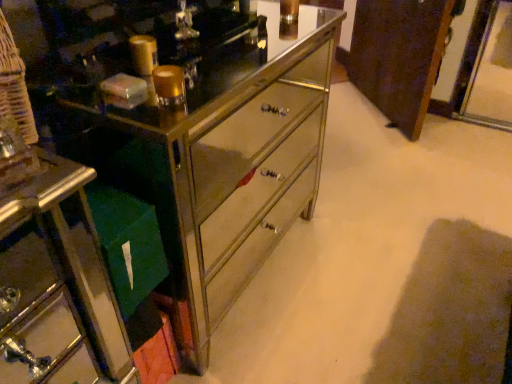
Question: Relative to brown wood cabinet at center, is metallic mirrored chest of drawers at center in front or behind?

Choices:
 (A) behind
 (B) front

Answer: (B)

Question: In terms of size, does metallic mirrored chest of drawers at center appear bigger or smaller than brown wood cabinet at center?

Choices:
 (A) big
 (B) small

Answer: (A)

Question: Considering the real-world distances, which object is closest to the green fabric bag at lower left?

Choices:
 (A) brown wood cabinet at center
 (B) metallic mirrored chest of drawers at center

Answer: (B)

Question: Based on their relative distances, which object is nearer to the metallic mirrored chest of drawers at center?

Choices:
 (A) brown wood cabinet at center
 (B) green fabric bag at lower left

Answer: (B)